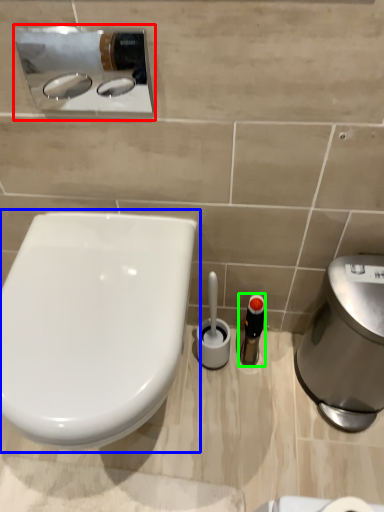
Question: Which object is positioned closest to sink (highlighted by a red box)? Select from toilet (highlighted by a blue box) and toiletry (highlighted by a green box).

Choices:
 (A) toilet
 (B) toiletry

Answer: (A)